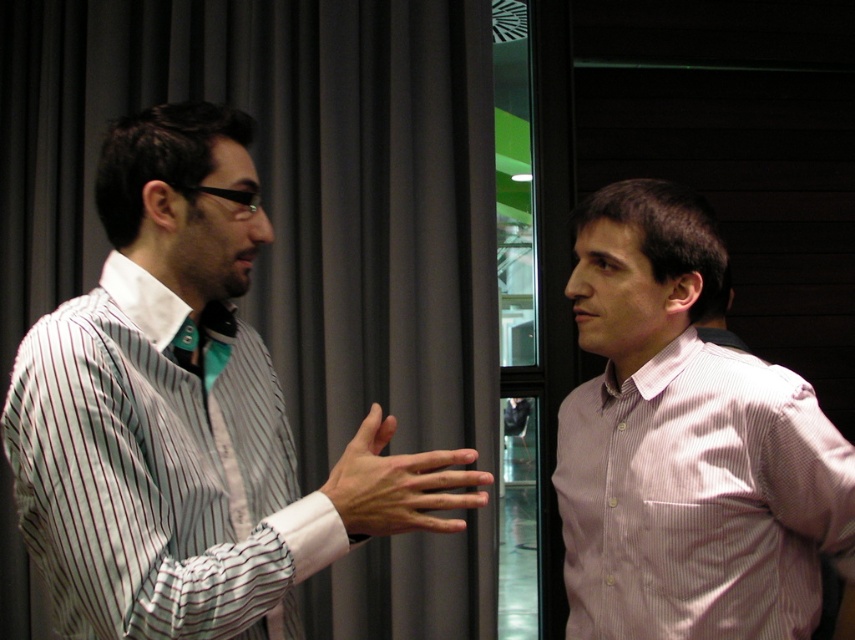
Question: Which point is closer to the camera taking this photo?

Choices:
 (A) (805, 540)
 (B) (523, 332)

Answer: (A)

Question: Which object is closer to the camera taking this photo?

Choices:
 (A) striped cotton shirt at left
 (B) transparent glass door at center

Answer: (A)

Question: Is striped cotton shirt at left closer to the viewer compared to transparent glass door at center?

Choices:
 (A) no
 (B) yes

Answer: (B)

Question: Is striped cotton shirt at left smaller than transparent glass door at center?

Choices:
 (A) yes
 (B) no

Answer: (A)

Question: Among these objects, which one is farthest from the camera?

Choices:
 (A) pink striped shirt at right
 (B) striped cotton shirt at left
 (C) transparent glass door at center

Answer: (C)

Question: Is striped cotton shirt at left thinner than pink striped shirt at right?

Choices:
 (A) yes
 (B) no

Answer: (B)